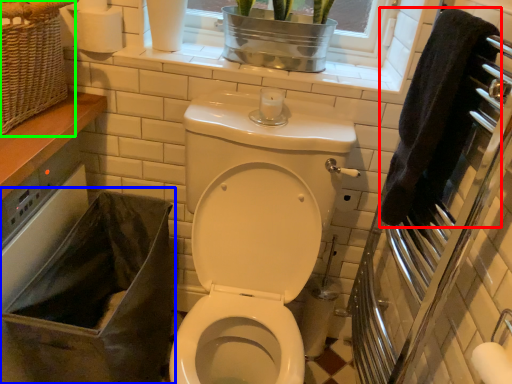
Question: Estimate the real-world distances between objects in this image. Which object is closer to hand towel (highlighted by a red box), laundry basket (highlighted by a blue box) or basket (highlighted by a green box)?

Choices:
 (A) laundry basket
 (B) basket

Answer: (A)